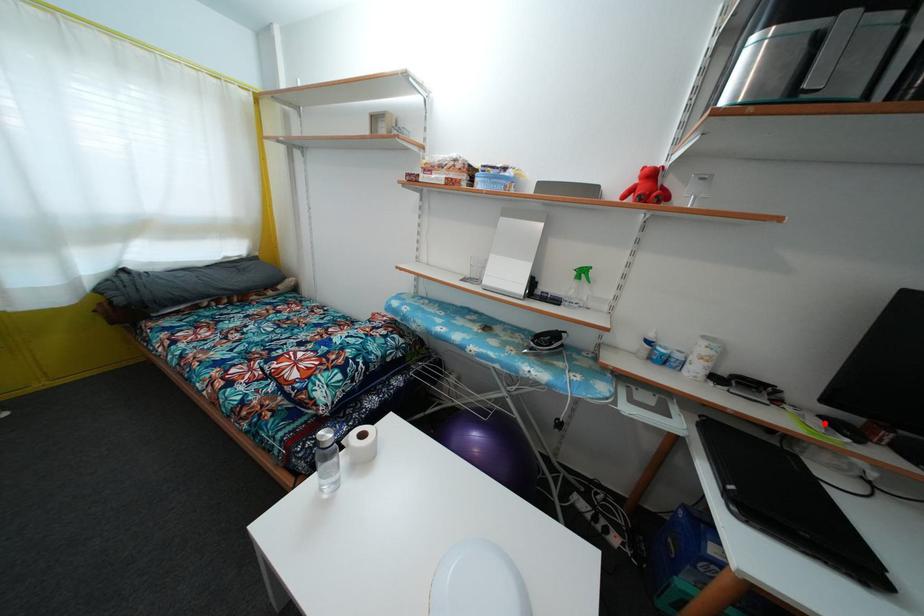
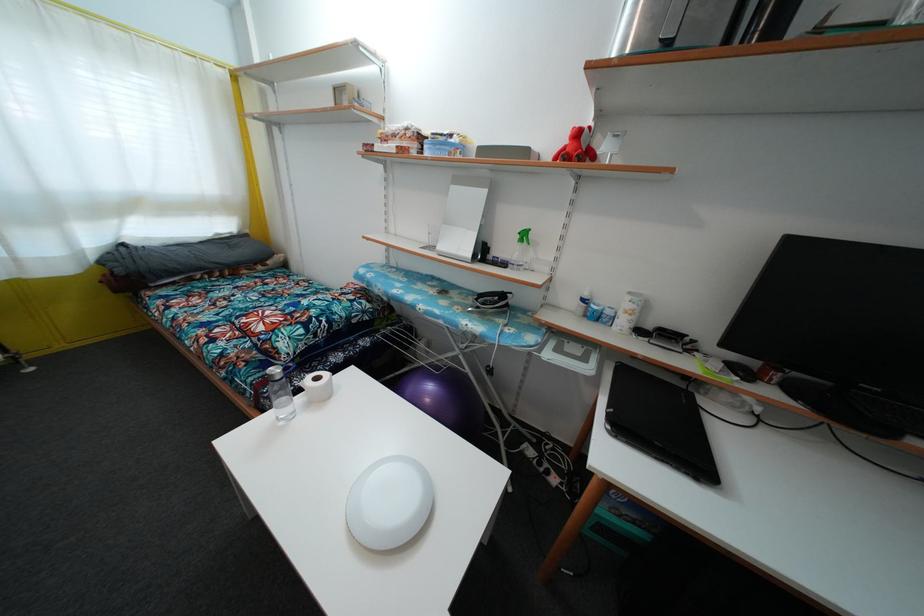
Locate, in the second image, the point that corresponds to the highlighted location in the first image.

(728, 369)